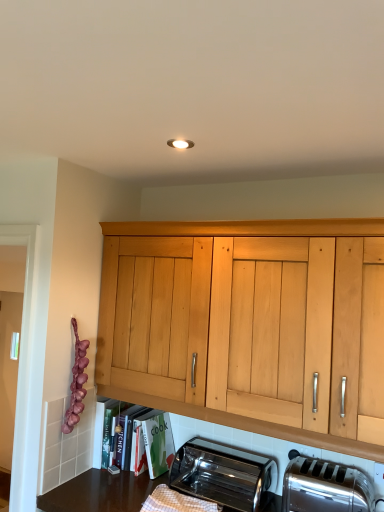
Question: In the image, is satin silver toaster at lower right, the first toaster positioned from the right, positioned in front of or behind matte wooden shelf at lower center?

Choices:
 (A) front
 (B) behind

Answer: (A)

Question: In terms of width, does satin silver toaster at lower right, which appears as the 2th toaster when viewed from the left, look wider or thinner when compared to matte wooden shelf at lower center?

Choices:
 (A) thin
 (B) wide

Answer: (A)

Question: Estimate the real-world distances between objects in this image. Which object is closer to the satin silver toaster at lower right, which appears as the 2th toaster when viewed from the left?

Choices:
 (A) matte wooden shelf at lower center
 (B) polished stainless steel toaster at lower center, the second toaster viewed from the right

Answer: (B)

Question: Considering the real-world distances, which object is closest to the polished stainless steel toaster at lower center, the second toaster viewed from the right?

Choices:
 (A) satin silver toaster at lower right, which appears as the 2th toaster when viewed from the left
 (B) matte wooden shelf at lower center

Answer: (A)